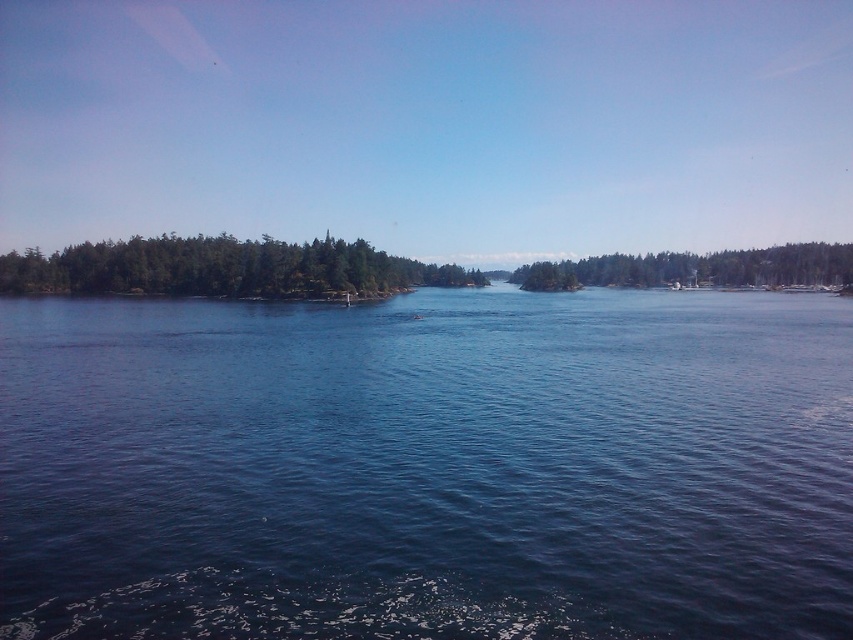
Question: Which point is closer to the camera taking this photo?

Choices:
 (A) (210, 269)
 (B) (376, 308)
 (C) (584, 264)

Answer: (B)

Question: Is blue liquid water at center below green matte trees at left?

Choices:
 (A) no
 (B) yes

Answer: (B)

Question: Is blue liquid water at center wider than green matte trees at left?

Choices:
 (A) yes
 (B) no

Answer: (B)

Question: Among these objects, which one is farthest from the camera?

Choices:
 (A) green matte trees at right
 (B) blue liquid water at center
 (C) green matte trees at left

Answer: (A)

Question: Is green matte trees at left to the left of green matte trees at right from the viewer's perspective?

Choices:
 (A) no
 (B) yes

Answer: (B)

Question: Which of the following is the farthest from the observer?

Choices:
 (A) (780, 248)
 (B) (428, 604)
 (C) (178, 253)

Answer: (A)